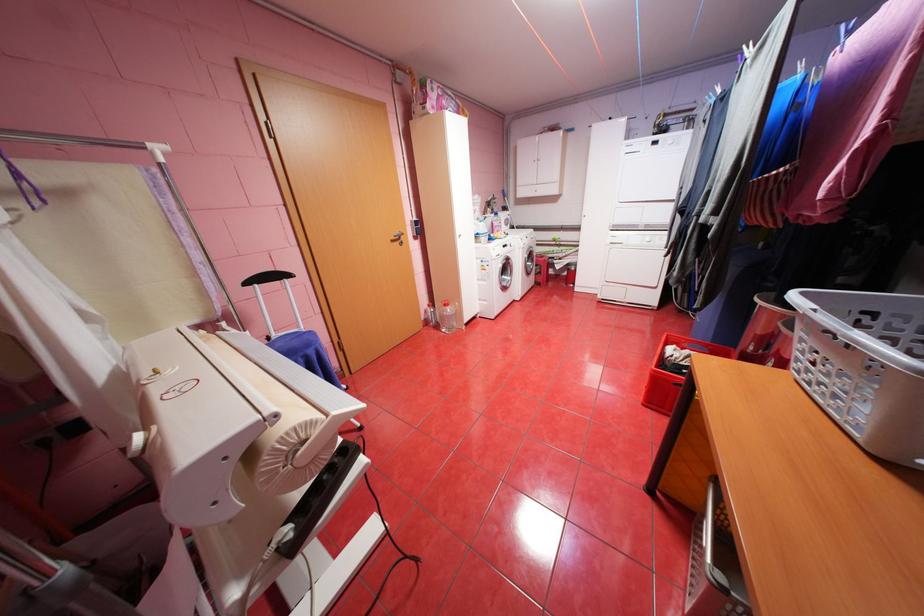
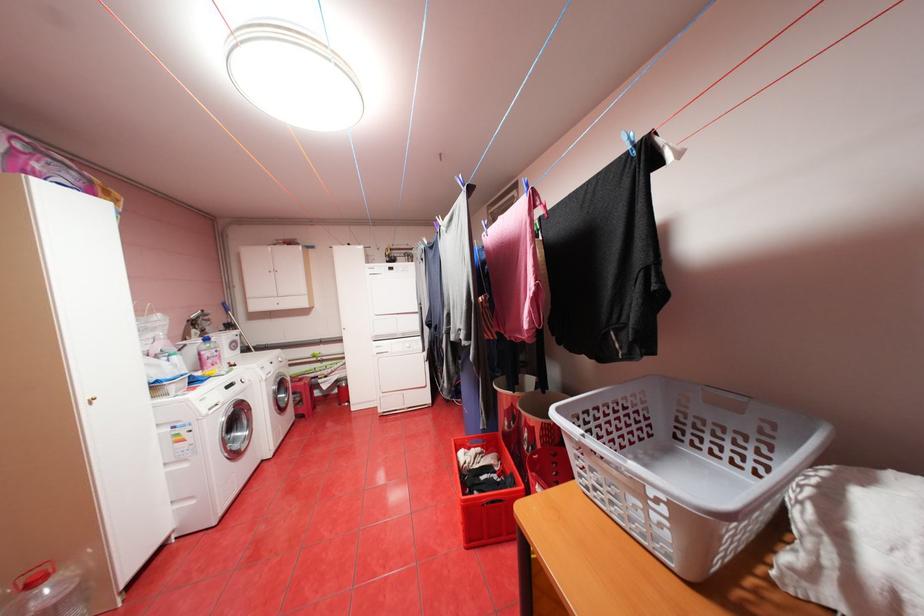
In the second image, find the point that corresponds to point 513,284 in the first image.

(245, 446)